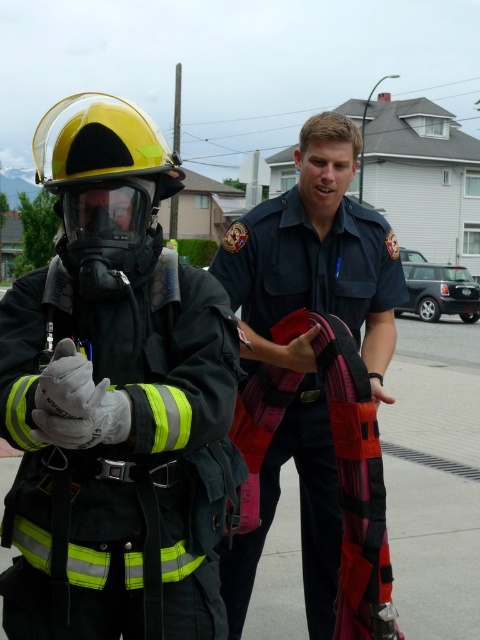
Question: Can you confirm if reflective black helmet at upper left is thinner than dark blue uniform at center?

Choices:
 (A) no
 (B) yes

Answer: (B)

Question: Among these points, which one is farthest from the camera?

Choices:
 (A) (338, 156)
 (B) (0, 577)

Answer: (A)

Question: Which point is closer to the camera?

Choices:
 (A) dark blue uniform at center
 (B) reflective black helmet at upper left

Answer: (B)

Question: Can you confirm if reflective black helmet at upper left is smaller than dark blue uniform at center?

Choices:
 (A) yes
 (B) no

Answer: (B)

Question: Can you confirm if reflective black helmet at upper left is thinner than dark blue uniform at center?

Choices:
 (A) yes
 (B) no

Answer: (A)

Question: Which point appears closest to the camera in this image?

Choices:
 (A) (263, 332)
 (B) (32, 355)

Answer: (B)